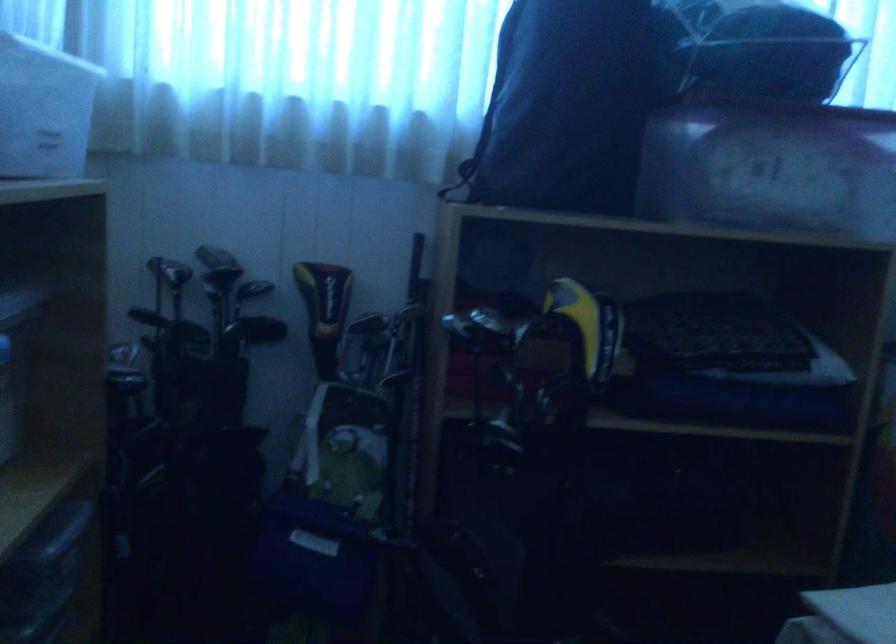
Identify the location of red club headcover. Image resolution: width=896 pixels, height=644 pixels. (549, 353).